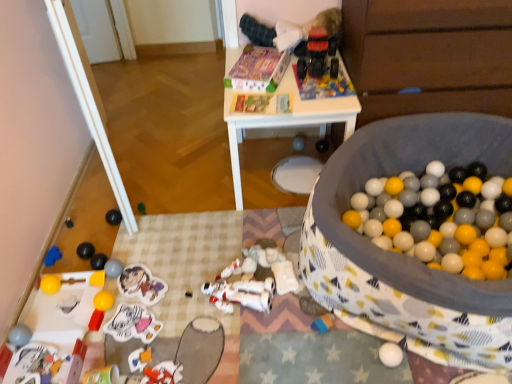
Measure the distance between matte white sticker at center, the eighth toy in the right-to-left sequence, and camera.

The depth of matte white sticker at center, the eighth toy in the right-to-left sequence, is 4.66 feet.

What do you see at coordinates (113, 217) in the screenshot? I see `black rubber ball at lower left, positioned as the seventh toy in left-to-right order` at bounding box center [113, 217].

The height and width of the screenshot is (384, 512). What do you see at coordinates (324, 85) in the screenshot?
I see `rubberized plastic toy car at center, the 20th toy in the left-to-right sequence` at bounding box center [324, 85].

Image resolution: width=512 pixels, height=384 pixels. Identify the location of matte gray ball at center, which ranks as the fourth toy in right-to-left order. (298, 143).

The image size is (512, 384). Find the location of `matte cardboard stickers at lower center, positioned as the 13th toy in left-to-right order`. matte cardboard stickers at lower center, positioned as the 13th toy in left-to-right order is located at coordinates (141, 284).

At what (x,y) coordinates should I click in order to perform the action: click on matte white sticker at center, the fourteenth toy when ordered from left to right. Please return your answer as a coordinate pair (x, y). Image resolution: width=512 pixels, height=384 pixels. Looking at the image, I should click on (133, 324).

Based on the photo, is shiny black ball at lower left, which is the 16th toy from right to left, smaller than yellow rubber ball at lower left, the 18th toy viewed from the right?

Actually, shiny black ball at lower left, which is the 16th toy from right to left, might be larger than yellow rubber ball at lower left, the 18th toy viewed from the right.

There is a yellow rubber ball at lower left, acting as the 4th toy starting from the left. Identify the location of the 2nd toy below it (from a real-world perspective). This screenshot has height=384, width=512. tap(85, 250).

Between shiny black ball at lower left, which is the 16th toy from right to left, and yellow rubber ball at lower left, the 18th toy viewed from the right, which one has more height?

shiny black ball at lower left, which is the 16th toy from right to left.

Would you say shiny black ball at lower left, which is the 16th toy from right to left, is inside or outside yellow rubber ball at lower left, acting as the 4th toy starting from the left?

shiny black ball at lower left, which is the 16th toy from right to left, is spatially situated outside yellow rubber ball at lower left, acting as the 4th toy starting from the left.

Looking at their sizes, would you say white matte robot at center, placed as the 7th toy when sorted from right to left, is wider or thinner than matte gray ball at lower left, which is counted as the tenth toy, starting from the left?

white matte robot at center, placed as the 7th toy when sorted from right to left, is wider than matte gray ball at lower left, which is counted as the tenth toy, starting from the left.

Looking at this image, considering their positions, is white matte robot at center, marked as the fifteenth toy in a left-to-right arrangement, located in front of or behind matte gray ball at lower left, which is counted as the tenth toy, starting from the left?

Clearly, white matte robot at center, marked as the fifteenth toy in a left-to-right arrangement, is in front of matte gray ball at lower left, which is counted as the tenth toy, starting from the left.

Consider the image. Is white matte robot at center, placed as the 7th toy when sorted from right to left, at the left side of matte gray ball at lower left, which is counted as the tenth toy, starting from the left?

Incorrect, white matte robot at center, placed as the 7th toy when sorted from right to left, is not on the left side of matte gray ball at lower left, which is counted as the tenth toy, starting from the left.

Can you tell me how much white matte robot at center, marked as the fifteenth toy in a left-to-right arrangement, and matte gray ball at lower left, which appears as the 12th toy when viewed from the right, differ in facing direction?

The angle between the facing direction of white matte robot at center, marked as the fifteenth toy in a left-to-right arrangement, and the facing direction of matte gray ball at lower left, which appears as the 12th toy when viewed from the right, is 12.3 degrees.

From the image's perspective, is shiny green ball at center, the 11th toy positioned from the left, under matte cardboard stickers at lower center, positioned as the 13th toy in left-to-right order?

No, from the image's perspective, shiny green ball at center, the 11th toy positioned from the left, is not beneath matte cardboard stickers at lower center, positioned as the 13th toy in left-to-right order.

Is the depth of shiny green ball at center, the eleventh toy in the right-to-left sequence, greater than that of matte cardboard stickers at lower center, positioned as the 13th toy in left-to-right order?

Yes, shiny green ball at center, the eleventh toy in the right-to-left sequence, is further from the camera.

Starting from the shiny green ball at center, the eleventh toy in the right-to-left sequence, which toy is the 12th one in front? Please provide its 2D coordinates.

[(141, 284)]

Is shiny green ball at center, the 11th toy positioned from the left, oriented towards matte cardboard stickers at lower center, which appears as the ninth toy when viewed from the right?

No, shiny green ball at center, the 11th toy positioned from the left, is not turned towards matte cardboard stickers at lower center, which appears as the ninth toy when viewed from the right.

Is smooth plastic toy at lower left, placed as the 17th toy when sorted from right to left, positioned far away from matte gray ball at lower left, which appears as the 12th toy when viewed from the right?

No, smooth plastic toy at lower left, placed as the 17th toy when sorted from right to left, is not far from matte gray ball at lower left, which appears as the 12th toy when viewed from the right.

In the scene shown: Is smooth plastic toy at lower left, placed as the 17th toy when sorted from right to left, shorter than matte gray ball at lower left, which is counted as the tenth toy, starting from the left?

Yes.

Which is in front, smooth plastic toy at lower left, which is the 5th toy in left-to-right order, or matte gray ball at lower left, which appears as the 12th toy when viewed from the right?

smooth plastic toy at lower left, which is the 5th toy in left-to-right order, is in front.

From their relative heights in the image, would you say shiny green ball at center, the eleventh toy in the right-to-left sequence, is taller or shorter than smooth plastic toy at lower left, which is the 5th toy in left-to-right order?

Clearly, shiny green ball at center, the eleventh toy in the right-to-left sequence, is shorter compared to smooth plastic toy at lower left, which is the 5th toy in left-to-right order.

Is shiny green ball at center, the eleventh toy in the right-to-left sequence, next to smooth plastic toy at lower left, which is the 5th toy in left-to-right order, and touching it?

They are not placed beside each other.

From the image's perspective, does shiny green ball at center, the 11th toy positioned from the left, appear lower than smooth plastic toy at lower left, placed as the 17th toy when sorted from right to left?

No.

Consider the image. How many degrees apart are the facing directions of shiny green ball at center, the 11th toy positioned from the left, and smooth plastic toy at lower left, placed as the 17th toy when sorted from right to left?

The angle between the facing direction of shiny green ball at center, the 11th toy positioned from the left, and the facing direction of smooth plastic toy at lower left, placed as the 17th toy when sorted from right to left, is 22.3 degrees.

Image resolution: width=512 pixels, height=384 pixels. There is a shiny black ball at lower left, which is the 16th toy from right to left. Find the location of `the 5th toy below it (from the image's perspective)`. the 5th toy below it (from the image's perspective) is located at coordinates (50, 284).

Which is behind, point (47, 279) or point (83, 246)?

Point (83, 246)

From the image's perspective, which one is positioned lower, yellow rubber ball at lower left, the 18th toy viewed from the right, or shiny black ball at lower left, which is the 16th toy from right to left?

yellow rubber ball at lower left, the 18th toy viewed from the right.

Could you tell me if yellow rubber ball at lower left, the 18th toy viewed from the right, is turned towards shiny black ball at lower left, which is the 16th toy from right to left?

No, yellow rubber ball at lower left, the 18th toy viewed from the right, is not turned towards shiny black ball at lower left, which is the 16th toy from right to left.

Could you tell me if soft fabric ball pit at center, marked as the first toy in a right-to-left arrangement, is turned towards matte cardboard stickers at lower center, positioned as the 13th toy in left-to-right order?

No, soft fabric ball pit at center, marked as the first toy in a right-to-left arrangement, is not oriented towards matte cardboard stickers at lower center, positioned as the 13th toy in left-to-right order.

Does soft fabric ball pit at center, marked as the first toy in a right-to-left arrangement, lie behind matte cardboard stickers at lower center, which appears as the ninth toy when viewed from the right?

No, soft fabric ball pit at center, marked as the first toy in a right-to-left arrangement, is closer to the viewer.

Find the location of a particular element. The height and width of the screenshot is (384, 512). the 7th toy in front when counting from the matte cardboard stickers at lower center, which appears as the ninth toy when viewed from the right is located at coordinates (404, 255).

Can you confirm if soft fabric ball pit at center, the 21th toy from the left, is positioned to the right of matte cardboard stickers at lower center, positioned as the 13th toy in left-to-right order?

Correct, you'll find soft fabric ball pit at center, the 21th toy from the left, to the right of matte cardboard stickers at lower center, positioned as the 13th toy in left-to-right order.

Identify the location of the 2nd toy to the right of the yellow rubber ball at lower left, the 18th toy viewed from the right, starting your count from the anchor. (85, 250).

Starting from the white matte robot at center, marked as the fifteenth toy in a left-to-right arrangement, which toy is the 7th one behind? Please provide its 2D coordinates.

[(113, 268)]

Estimate the real-world distances between objects in this image. Which object is further from rubberized red toy truck at upper center, the nineteenth toy from the left, white plastic table at upper center or soft fabric ball pit at center, marked as the first toy in a right-to-left arrangement?

soft fabric ball pit at center, marked as the first toy in a right-to-left arrangement, is positioned further to the anchor rubberized red toy truck at upper center, the nineteenth toy from the left.

From the image, which object appears to be farther from matte gray ball at center, which ranks as the fourth toy in right-to-left order, white plastic table at upper center or matte gray ball at lower left, which appears as the 12th toy when viewed from the right?

matte gray ball at lower left, which appears as the 12th toy when viewed from the right, lies further to matte gray ball at center, which ranks as the fourth toy in right-to-left order, than the other object.

Estimate the real-world distances between objects in this image. Which object is closer to yellow rubber ball at lower left, acting as the 4th toy starting from the left, shiny black ball at lower left, placed as the sixth toy when sorted from left to right, or black rubber ball at lower left, the 15th toy in the right-to-left sequence?

Among the two, shiny black ball at lower left, placed as the sixth toy when sorted from left to right, is located nearer to yellow rubber ball at lower left, acting as the 4th toy starting from the left.

Estimate the real-world distances between objects in this image. Which object is further from white fabric doll at center, placed as the fifth toy when sorted from right to left, white plastic table at upper center or matte gray ball at lower left, arranged as the nineteenth toy when viewed from the right?

Based on the image, matte gray ball at lower left, arranged as the nineteenth toy when viewed from the right, appears to be further to white fabric doll at center, placed as the fifth toy when sorted from right to left.

Considering their positions, is white matte robot at center, marked as the fifteenth toy in a left-to-right arrangement, positioned closer to yellow rubber ball at lower left, acting as the 4th toy starting from the left, than soft fabric ball pit at center, marked as the first toy in a right-to-left arrangement?

Based on the image, white matte robot at center, marked as the fifteenth toy in a left-to-right arrangement, appears to be nearer to yellow rubber ball at lower left, acting as the 4th toy starting from the left.

Which object lies nearer to the anchor point matte gray ball at center, which ranks as the fourth toy in right-to-left order, matte white sticker at center, the fourteenth toy when ordered from left to right, or rubberized plastic toy car at center, the 20th toy in the left-to-right sequence?

rubberized plastic toy car at center, the 20th toy in the left-to-right sequence, is closer to matte gray ball at center, which ranks as the fourth toy in right-to-left order.

Looking at the image, which one is located closer to black rubber ball at lower left, positioned as the seventh toy in left-to-right order, smooth plastic toy at lower left, placed as the 17th toy when sorted from right to left, or blue rubber duck at lower left, acting as the 2th toy starting from the left?

Based on the image, blue rubber duck at lower left, acting as the 2th toy starting from the left, appears to be nearer to black rubber ball at lower left, positioned as the seventh toy in left-to-right order.

Looking at the image, which one is located closer to yellow rubber ball at lower left, acting as the 4th toy starting from the left, white plastic table at upper center or smooth black ball at lower left, the 21th toy from the right?

Based on the image, smooth black ball at lower left, the 21th toy from the right, appears to be nearer to yellow rubber ball at lower left, acting as the 4th toy starting from the left.

Where is `table between black rubber ball at lower left, the 15th toy in the right-to-left sequence, and rubberized plastic toy car at center, the 20th toy in the left-to-right sequence, in the horizontal direction`? This screenshot has width=512, height=384. table between black rubber ball at lower left, the 15th toy in the right-to-left sequence, and rubberized plastic toy car at center, the 20th toy in the left-to-right sequence, in the horizontal direction is located at coordinates [x=286, y=120].

At what (x,y) coordinates should I click in order to perform the action: click on table between rubberized plastic toy car at center, the 20th toy in the left-to-right sequence, and plastic toy at lower left, marked as the twelfth toy in a left-to-right arrangement, in the up-down direction. Please return your answer as a coordinate pair (x, y). The height and width of the screenshot is (384, 512). Looking at the image, I should click on (286, 120).

Where is `table between rubberized plastic toy car at center, the 2th toy from the right, and matte cardboard stickers at lower center, positioned as the 13th toy in left-to-right order, in the up-down direction`? table between rubberized plastic toy car at center, the 2th toy from the right, and matte cardboard stickers at lower center, positioned as the 13th toy in left-to-right order, in the up-down direction is located at coordinates (286, 120).

Where is `table positioned between soft fabric ball pit at center, the 21th toy from the left, and white fabric doll at center, placed as the fifth toy when sorted from right to left, from near to far`? The height and width of the screenshot is (384, 512). table positioned between soft fabric ball pit at center, the 21th toy from the left, and white fabric doll at center, placed as the fifth toy when sorted from right to left, from near to far is located at coordinates (286, 120).